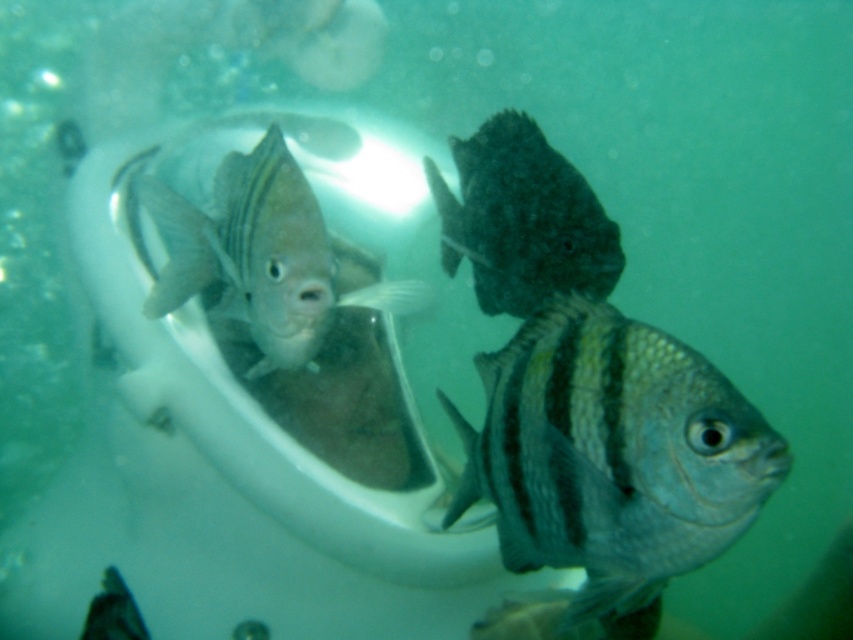
You are a scuba diver who wants to take a photo of the dark matte fish at center and the shiny silver fish at lower left. Since you want both fish to be in focus, which one should you adjust your camera focus on first?

You should focus on the dark matte fish at center first because it is closer to you than the shiny silver fish at lower left, so adjusting focus starting from the closer object ensures both can be in focus.

You are a scuba diver trying to locate two points marked in the image. Which of the two points, point (601, 557) or point (123, 586), is nearer to you?

Point (601, 557) is closer to the camera than point (123, 586), so it is nearer to you.

You are a marine biologist observing the underwater scene. You notice the dark matte fish at center and the shiny silver fish at lower left. Which fish has a greater width?

The dark matte fish at center has a greater width than the shiny silver fish at lower left.